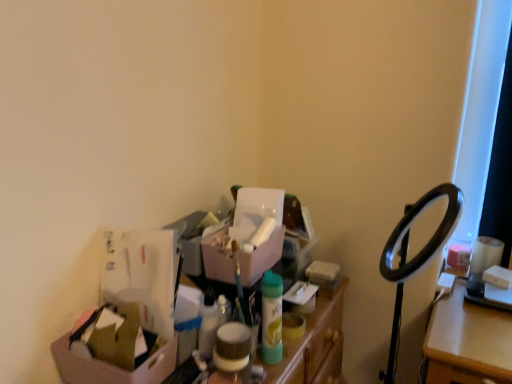
Question: From a real-world perspective, is cardboard box at lower left, the first box in the bottom-to-top sequence, on top of matte plastic storage bin at center?

Choices:
 (A) no
 (B) yes

Answer: (B)

Question: Would you say cardboard box at lower left, the 1th box when ordered from front to back, is outside matte plastic storage bin at center?

Choices:
 (A) no
 (B) yes

Answer: (B)

Question: Is cardboard box at lower left, which is the second box in right-to-left order, shorter than matte plastic storage bin at center?

Choices:
 (A) yes
 (B) no

Answer: (A)

Question: Is cardboard box at lower left, the first box in the bottom-to-top sequence, positioned behind matte plastic storage bin at center?

Choices:
 (A) yes
 (B) no

Answer: (B)

Question: Is cardboard box at lower left, which is the second box in right-to-left order, aimed at matte plastic storage bin at center?

Choices:
 (A) no
 (B) yes

Answer: (A)

Question: In terms of width, does matte pink box at center, the second box when ordered from front to back, look wider or thinner when compared to cardboard box at lower left, placed as the 2th box when sorted from back to front?

Choices:
 (A) thin
 (B) wide

Answer: (A)

Question: From the image's perspective, relative to cardboard box at lower left, acting as the 1th box starting from the left, is matte pink box at center, which ranks as the 2th box in bottom-to-top order, above or below?

Choices:
 (A) below
 (B) above

Answer: (B)

Question: Looking at the image, does matte pink box at center, the first box from the right, seem bigger or smaller compared to cardboard box at lower left, acting as the 1th box starting from the left?

Choices:
 (A) big
 (B) small

Answer: (A)

Question: Is point (212, 276) positioned closer to the camera than point (106, 365)?

Choices:
 (A) closer
 (B) farther

Answer: (B)

Question: Is cardboard box at lower left, acting as the 1th box starting from the left, taller or shorter than matte pink box at center, which ranks as the 2th box in bottom-to-top order?

Choices:
 (A) short
 (B) tall

Answer: (A)

Question: From the image's perspective, is cardboard box at lower left, the 1th box when ordered from front to back, positioned above or below matte pink box at center, the second box when ordered from front to back?

Choices:
 (A) below
 (B) above

Answer: (A)

Question: Based on their positions, is cardboard box at lower left, the 1th box when ordered from front to back, located to the left or right of matte pink box at center, which ranks as the 2th box in bottom-to-top order?

Choices:
 (A) right
 (B) left

Answer: (B)

Question: Based on their sizes in the image, would you say cardboard box at lower left, the 1th box when ordered from front to back, is bigger or smaller than matte pink box at center, positioned as the first box in top-to-bottom order?

Choices:
 (A) big
 (B) small

Answer: (B)

Question: From their relative heights in the image, would you say matte plastic storage bin at center is taller or shorter than cardboard box at lower left, which is the second box in right-to-left order?

Choices:
 (A) short
 (B) tall

Answer: (B)

Question: From the image's perspective, is matte plastic storage bin at center located above or below cardboard box at lower left, placed as the 2th box when sorted from top to bottom?

Choices:
 (A) above
 (B) below

Answer: (B)